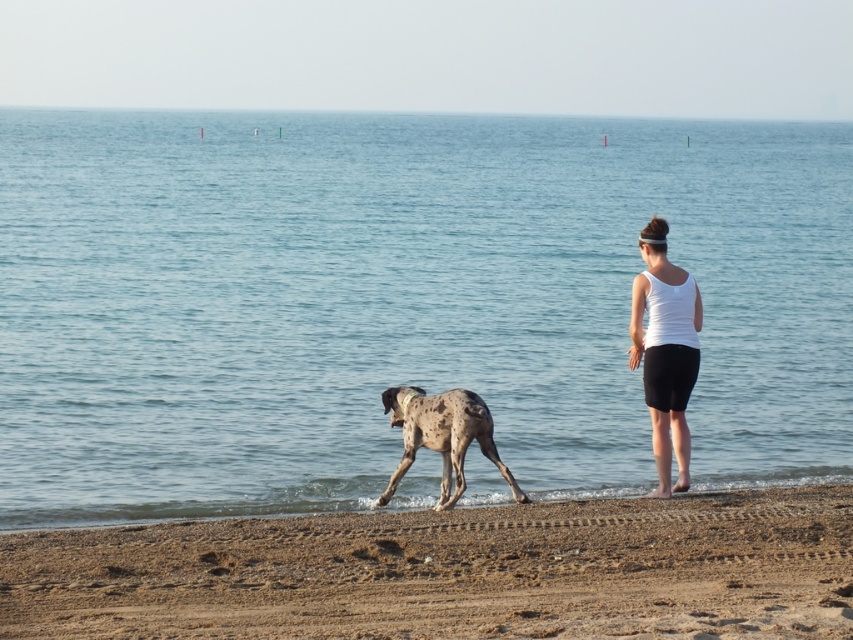
Question: Which point is closer to the camera?

Choices:
 (A) (682, 488)
 (B) (292, 598)
 (C) (212, 172)
 (D) (445, 417)

Answer: (B)

Question: Among these points, which one is nearest to the camera?

Choices:
 (A) (668, 401)
 (B) (462, 481)
 (C) (276, 259)

Answer: (B)

Question: Which is farther from the blue water at center?

Choices:
 (A) spotted fur dog at center
 (B) brown sandy beach at lower center
 (C) white matte tank top at center

Answer: (C)

Question: Is blue water at center positioned in front of spotted fur dog at center?

Choices:
 (A) yes
 (B) no

Answer: (B)

Question: Does blue water at center appear on the left side of spotted fur dog at center?

Choices:
 (A) yes
 (B) no

Answer: (B)

Question: Is blue water at center smaller than spotted fur dog at center?

Choices:
 (A) yes
 (B) no

Answer: (B)